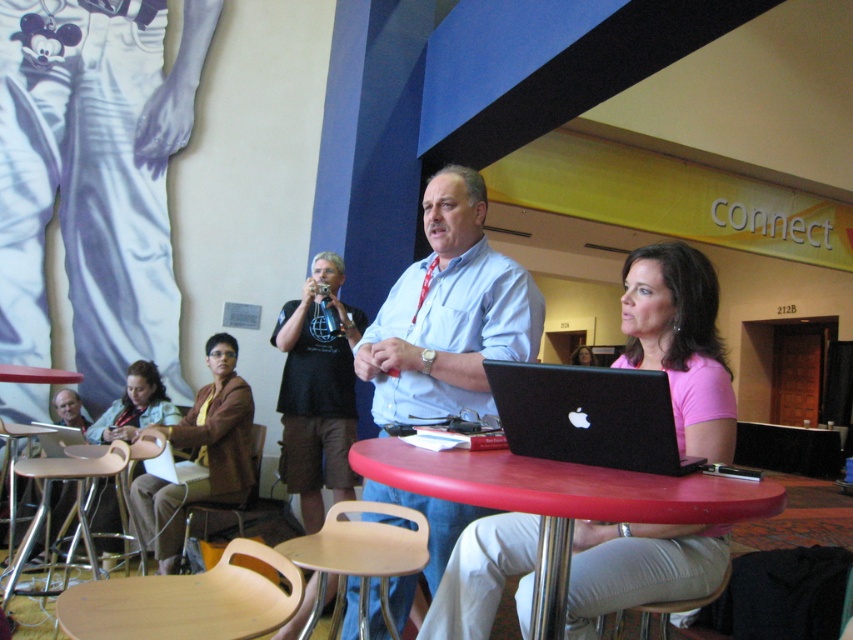
Question: Which of these objects is positioned closest to the matte plastic table at center?

Choices:
 (A) pink fabric shirt at center
 (B) pink matte shirt at center
 (C) light blue shirt at center
 (D) brown fabric jacket at lower left

Answer: (B)

Question: Which object is the closest to the black matte laptop at center?

Choices:
 (A) light blue shirt at center
 (B) matte plastic table at center
 (C) pink fabric shirt at center

Answer: (B)

Question: Can you confirm if pink matte shirt at center is positioned below black fabric shirt at center?

Choices:
 (A) no
 (B) yes

Answer: (B)

Question: Is the position of light blue shirt at center less distant than that of black matte laptop at center?

Choices:
 (A) no
 (B) yes

Answer: (A)

Question: Is the position of brown fabric jacket at lower left more distant than that of pink fabric shirt at center?

Choices:
 (A) no
 (B) yes

Answer: (A)

Question: Which point is farther to the camera?

Choices:
 (A) (x=22, y=563)
 (B) (x=294, y=451)

Answer: (B)